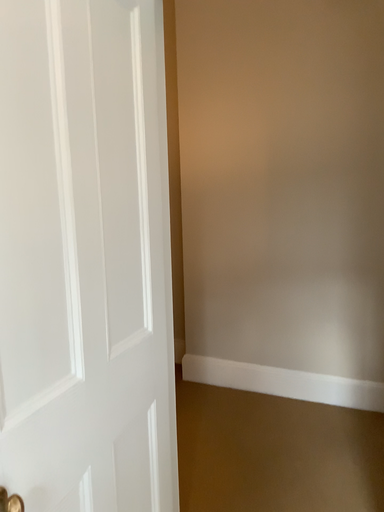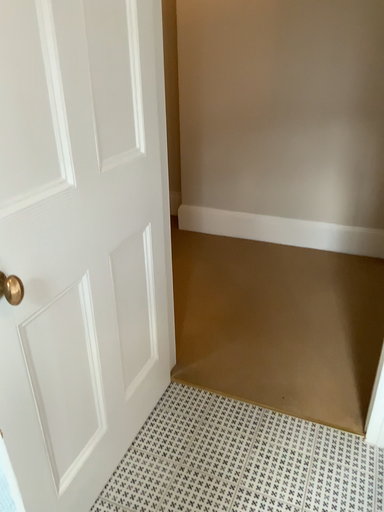
Question: How did the camera likely rotate when shooting the video?

Choices:
 (A) rotated upward
 (B) rotated downward

Answer: (B)